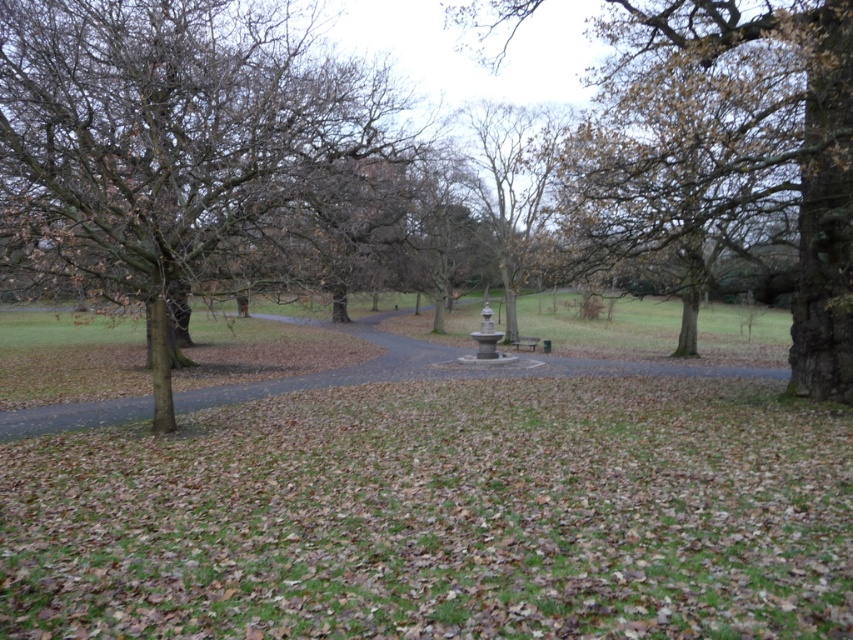
Question: Is smooth gray stone fountain at center positioned in front of wooden bench at center?

Choices:
 (A) yes
 (B) no

Answer: (A)

Question: Considering the relative positions of gravel path at center and smooth gray stone fountain at center in the image provided, where is gravel path at center located with respect to smooth gray stone fountain at center?

Choices:
 (A) below
 (B) above

Answer: (A)

Question: Which point is farther to the camera?

Choices:
 (A) (527, 337)
 (B) (608, 368)
 (C) (296, 200)

Answer: (A)

Question: Which of the following is the farthest from the observer?

Choices:
 (A) wooden bench at center
 (B) brown leafy tree at center

Answer: (A)

Question: Which of the following is the closest to the observer?

Choices:
 (A) brown leafy tree at center
 (B) brown textured tree at center
 (C) gravel path at center

Answer: (A)

Question: In this image, where is brown leafy tree at center located relative to brown textured tree at center?

Choices:
 (A) right
 (B) left

Answer: (B)